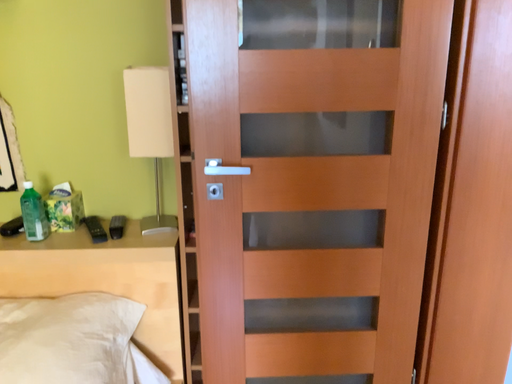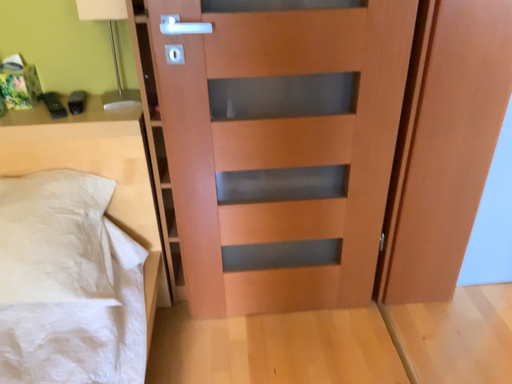
Question: Which way did the camera rotate in the video?

Choices:
 (A) rotated upward
 (B) rotated downward

Answer: (B)